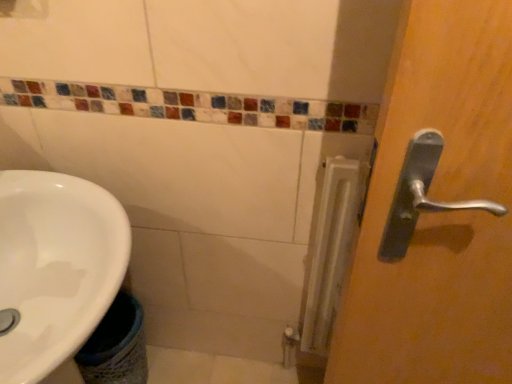
Locate an element on the screen. This screenshot has height=384, width=512. white glossy sink at lower left is located at coordinates (56, 270).

What do you see at coordinates (56, 270) in the screenshot?
I see `white glossy sink at lower left` at bounding box center [56, 270].

Where is `white glossy sink at lower left`? This screenshot has height=384, width=512. white glossy sink at lower left is located at coordinates (56, 270).